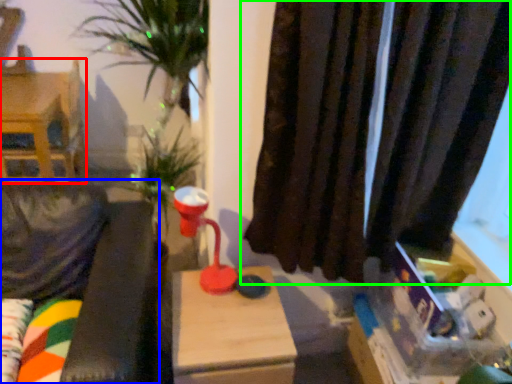
Question: Considering the real-world distances, which object is farthest from furniture (highlighted by a red box)? couch (highlighted by a blue box) or curtain (highlighted by a green box)?

Choices:
 (A) couch
 (B) curtain

Answer: (B)